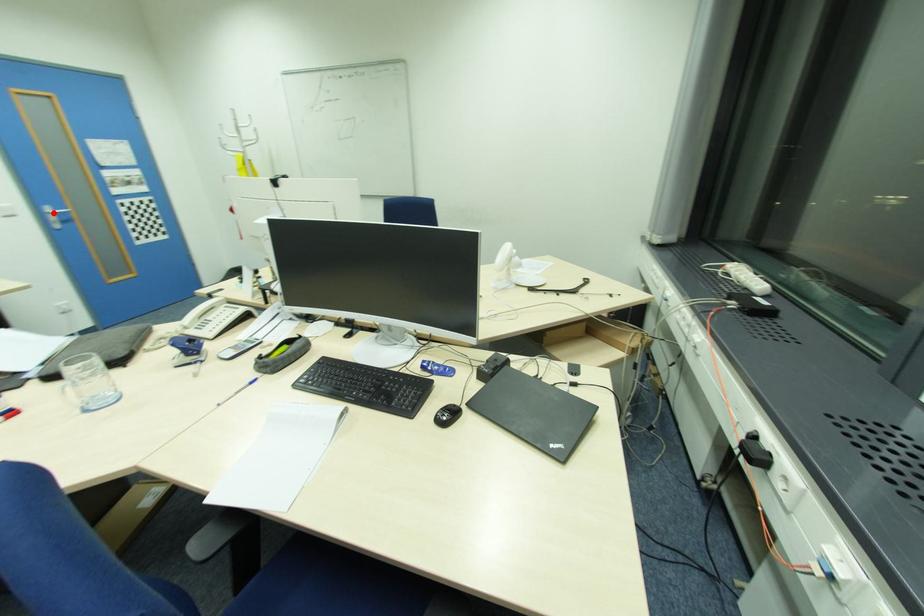
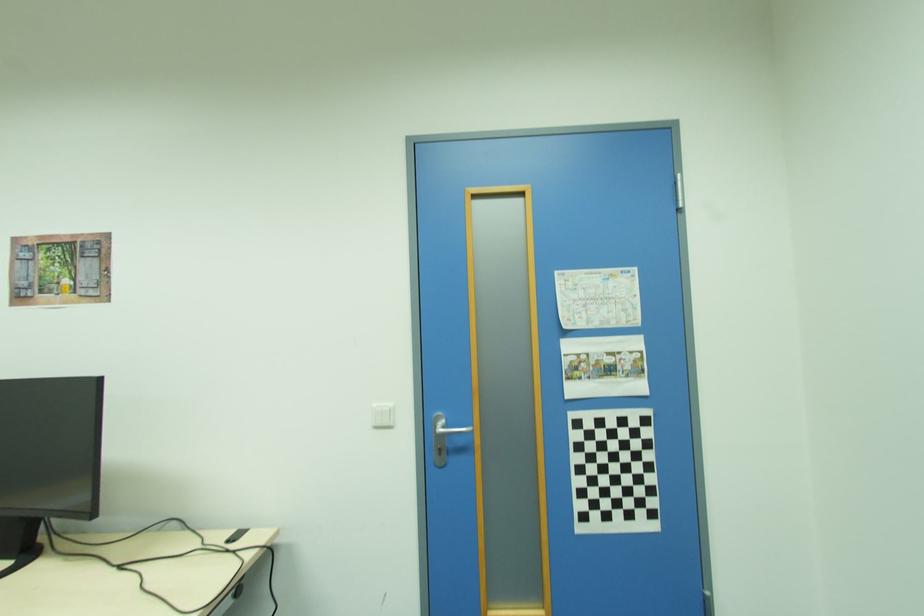
The point at the highlighted location is marked in the first image. Where is the corresponding point in the second image?

(439, 429)